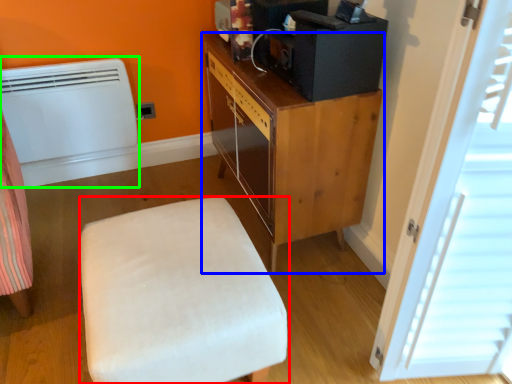
Question: Based on their relative distances, which object is farther from furniture (highlighted by a red box)? Choose from cabinetry (highlighted by a blue box) and heater (highlighted by a green box).

Choices:
 (A) cabinetry
 (B) heater

Answer: (B)